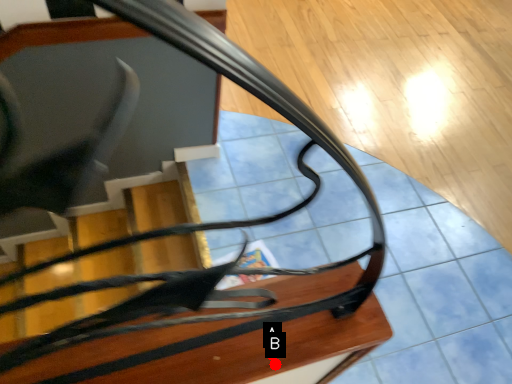
Question: Two points are circled on the image, labeled by A and B beside each circle. Which point is farther to the camera?

Choices:
 (A) A is further
 (B) B is further

Answer: (A)